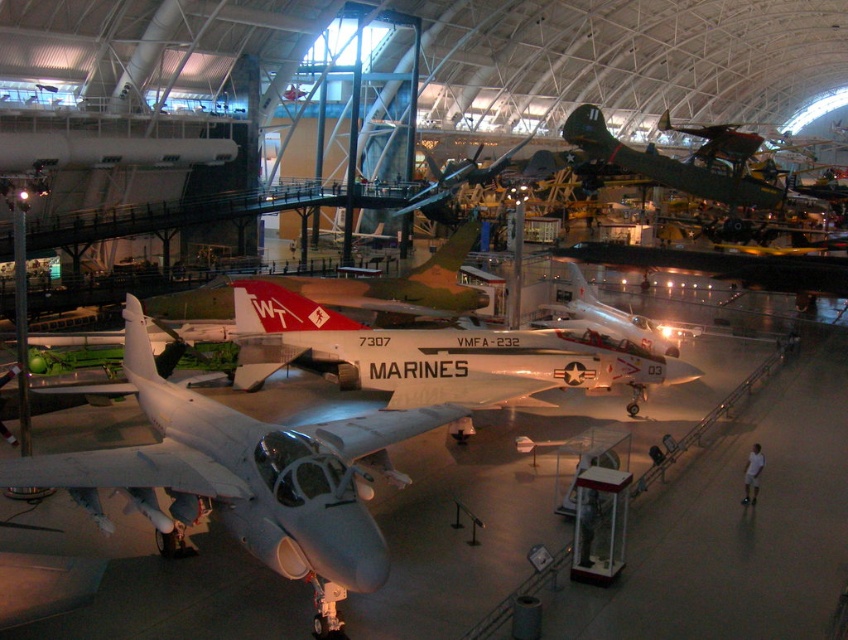
Question: Which point is closer to the camera?

Choices:
 (A) (651, 333)
 (B) (299, 349)
 (C) (729, 188)

Answer: (B)

Question: Estimate the real-world distances between objects in this image. Which object is closer to the green matte airplane at upper right?

Choices:
 (A) white matte airplane at center
 (B) silver metallic airplane at center

Answer: (B)

Question: Is matte gray jet at center thinner than green matte airplane at upper right?

Choices:
 (A) yes
 (B) no

Answer: (A)

Question: Is matte gray jet at center behind white matte airplane at center?

Choices:
 (A) yes
 (B) no

Answer: (B)

Question: Which is nearer to the white matte airplane at center?

Choices:
 (A) silver metallic airplane at center
 (B) green matte airplane at upper right
 (C) matte gray jet at center

Answer: (A)

Question: Can you confirm if green matte airplane at upper right is thinner than silver metallic airplane at center?

Choices:
 (A) no
 (B) yes

Answer: (A)